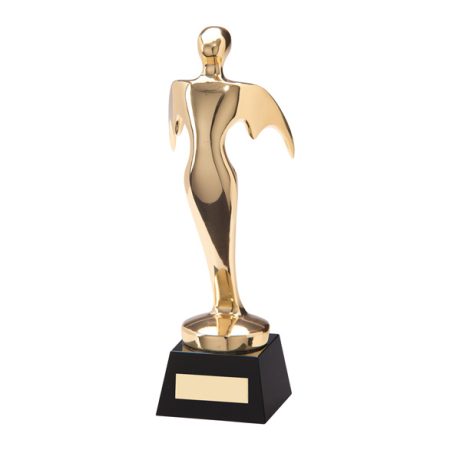
Image resolution: width=450 pixels, height=450 pixels. What are the coordinates of `award` in the screenshot? It's located at (216, 45).